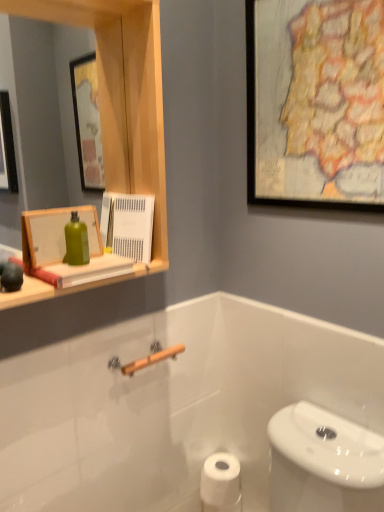
Question: Relative to wooden framed map at upper right, which ranks as the first picture frame in top-to-bottom order, is wooden picture frame at upper left, positioned as the 1th picture frame in bottom-to-top order, in front or behind?

Choices:
 (A) behind
 (B) front

Answer: (A)

Question: Considering the positions of wooden picture frame at upper left, the second picture frame when ordered from right to left, and wooden framed map at upper right, positioned as the second picture frame in bottom-to-top order, in the image, is wooden picture frame at upper left, the second picture frame when ordered from right to left, wider or thinner than wooden framed map at upper right, positioned as the second picture frame in bottom-to-top order,?

Choices:
 (A) wide
 (B) thin

Answer: (A)

Question: Which object is the farthest from the wooden medicine cabinet at upper left?

Choices:
 (A) wooden picture frame at upper left, which is the 1th picture frame in left-to-right order
 (B) wooden framed map at upper right, which ranks as the first picture frame in top-to-bottom order
 (C) white matte toilet paper at lower center

Answer: (C)

Question: Which of these objects is positioned closest to the white matte toilet paper at lower center?

Choices:
 (A) wooden framed map at upper right, positioned as the second picture frame in bottom-to-top order
 (B) wooden picture frame at upper left, acting as the second picture frame starting from the top
 (C) wooden medicine cabinet at upper left

Answer: (B)